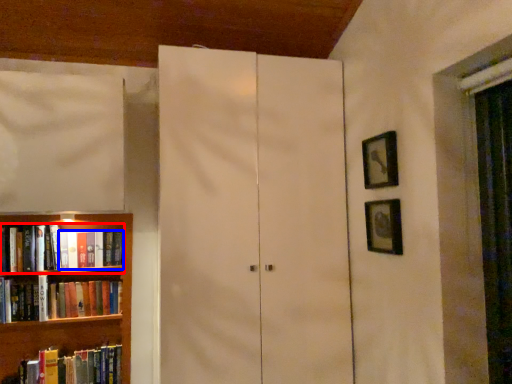
Question: Which of the following is the farthest to the observer, book (highlighted by a red box) or book (highlighted by a blue box)?

Choices:
 (A) book
 (B) book

Answer: (B)